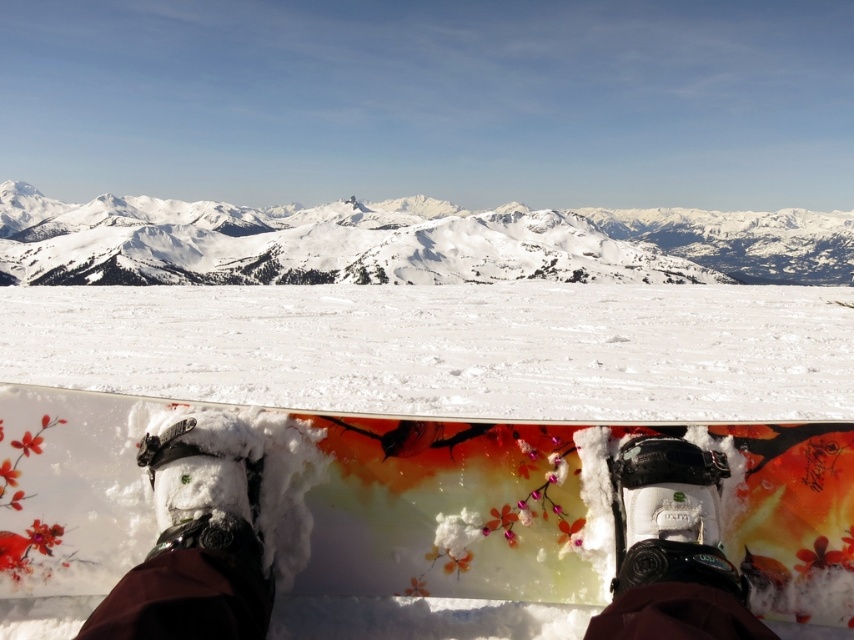
Looking at this image, you are standing on a snowboard with a colorful floral design in the foreground of a serene winter scene. You notice a point marked at coordinates (449, 348). Based on the scene, where is this point located?

The point at coordinates (449, 348) is located on the white glossy snow at center.

You are standing on a snowboard with a floral design in the foreground of a serene winter scene. You want to reach a point located at coordinates (820,417). Given that the point is 19.97 meters away from you, can you estimate how far you need to travel to reach it?

The point at coordinates (820,417) is 19.97 meters away from your current position on the snowboard, so you need to travel approximately 19.97 meters to reach it.